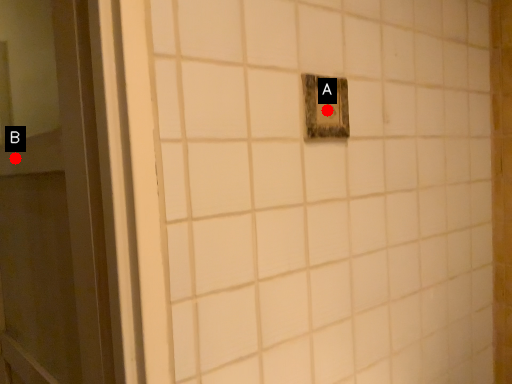
Question: Two points are circled on the image, labeled by A and B beside each circle. Which point is closer to the camera?

Choices:
 (A) A is closer
 (B) B is closer

Answer: (A)